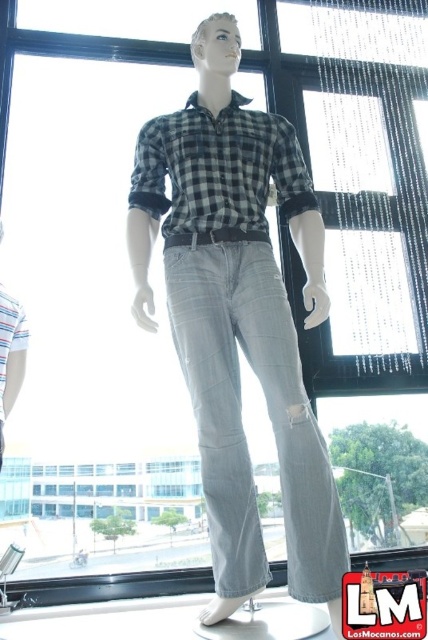
You are a fashion designer observing the mannequin. You need to determine if the light blue denim jeans at center can be paired with the checkered fabric shirt at center based on their widths. Which one is narrower?

The light blue denim jeans at center has a lesser width compared to the checkered fabric shirt at center, so they can be paired together as the jeans are narrower.

Please describe the exact position of the light blue denim jeans at center in the image using coordinates.

The light blue denim jeans at center is located at the 2D coordinates point of (240, 413).